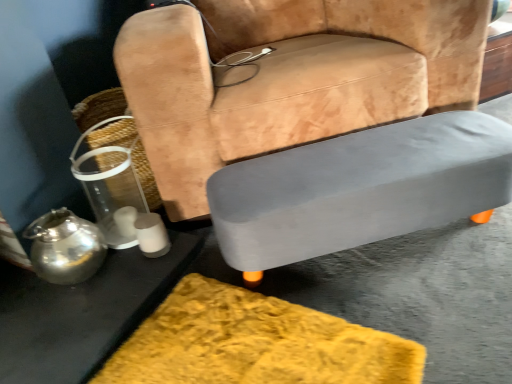
Locate an element on the screen. Image resolution: width=512 pixels, height=384 pixels. free space above shiny metallic teapot at lower left (from a real-world perspective) is located at coordinates (47, 233).